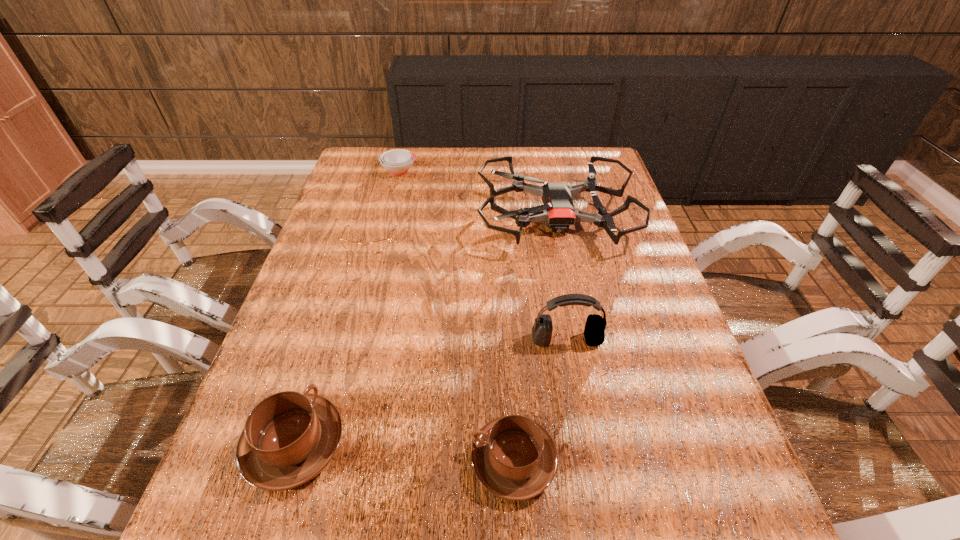
The width and height of the screenshot is (960, 540). I want to click on vacant area that lies between the shorter cappuccino and the second shortest object, so click(457, 316).

Locate an element on the screen. The width and height of the screenshot is (960, 540). unoccupied area between the drone and the shortest object is located at coordinates (463, 229).

Identify the location of vacant point located between the left cappuccino and the shortest object. Image resolution: width=960 pixels, height=540 pixels. (332, 343).

At what (x,y) coordinates should I click in order to perform the action: click on unoccupied area between the taller cappuccino and the soup bowl. Please return your answer as a coordinate pair (x, y). Looking at the image, I should click on (348, 308).

Identify the location of vacant space in between the farthest object and the drone. (478, 194).

Identify which object is located as the third nearest to the shortest object. Please provide its 2D coordinates. Your answer should be formatted as a tuple, i.e. [(x, y)], where the tuple contains the x and y coordinates of a point satisfying the conditions above.

[(594, 332)]

Select which object appears as the fourth closest to the shortest object. Please provide its 2D coordinates. Your answer should be formatted as a tuple, i.e. [(x, y)], where the tuple contains the x and y coordinates of a point satisfying the conditions above.

[(289, 437)]

The height and width of the screenshot is (540, 960). I want to click on free location that satisfies the following two spatial constraints: 1. with the camera facing forward on the drone; 2. on the headband of the third nearest object, so click(x=581, y=340).

I want to click on free point that satisfies the following two spatial constraints: 1. on the headband of the tallest object; 2. on the side of the third shortest object with the handle, so click(588, 461).